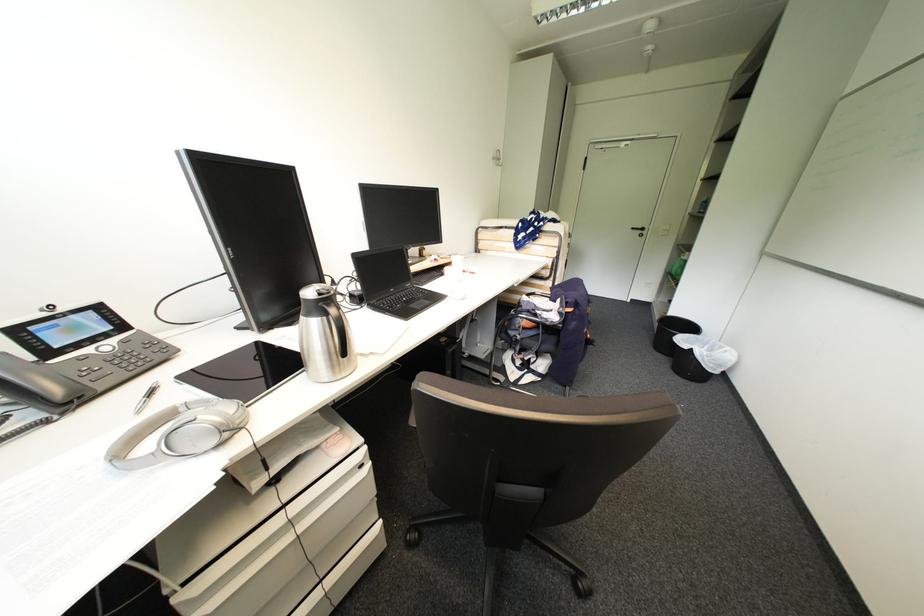
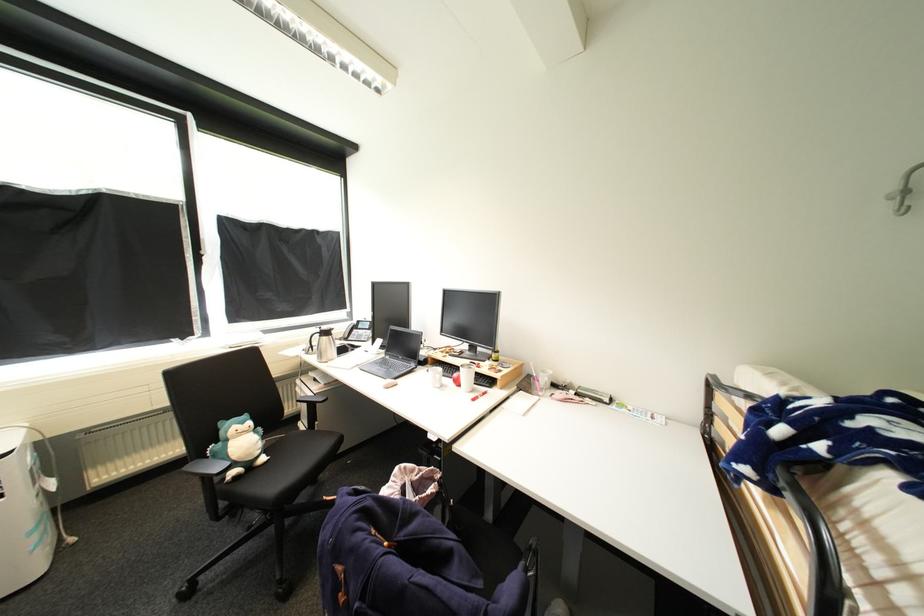
In the second image, find the point that corresponds to the point at 83,347 in the first image.

(367, 330)